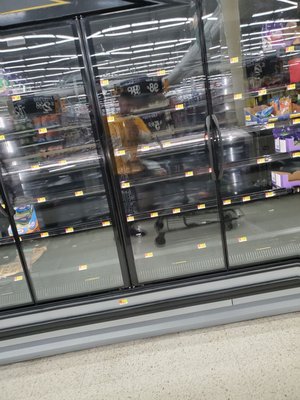
Where is `shoe`? The height and width of the screenshot is (400, 300). shoe is located at coordinates (133, 230).